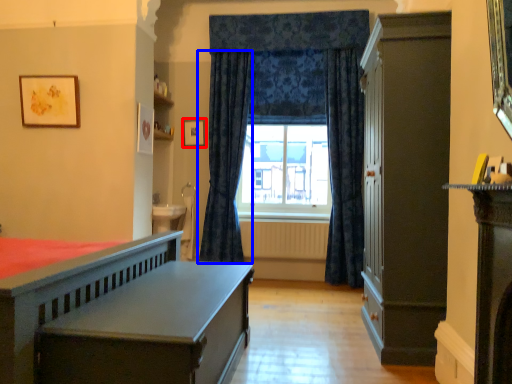
Question: Which of the following is the farthest to the observer, picture frame (highlighted by a red box) or curtain (highlighted by a blue box)?

Choices:
 (A) picture frame
 (B) curtain

Answer: (A)